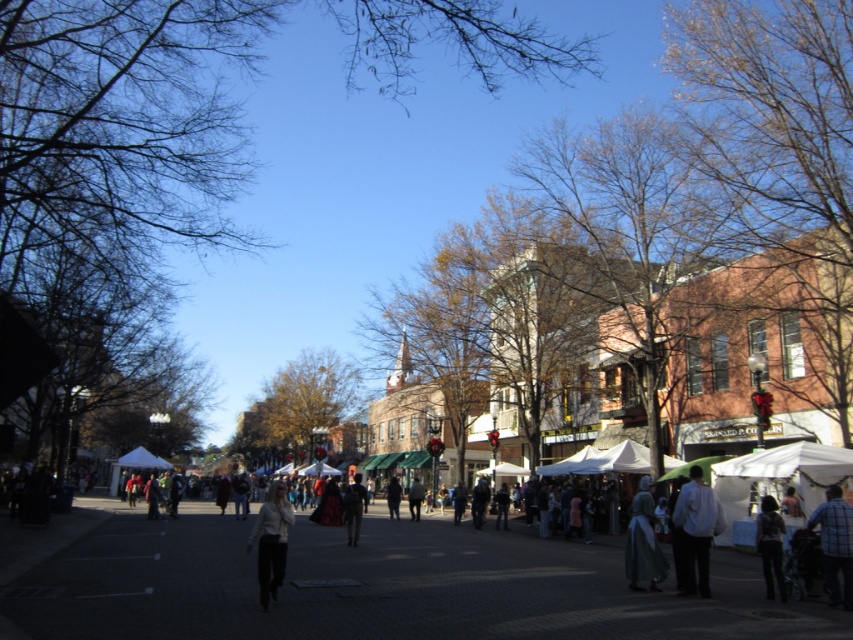
Question: Does white matte pants at center have a smaller size compared to white fabric canopy at center?

Choices:
 (A) yes
 (B) no

Answer: (A)

Question: Which object appears farthest from the camera in this image?

Choices:
 (A) plaid shirt at lower right
 (B) white cotton shirt at lower right
 (C) denim jacket at lower right
 (D) white matte pants at center

Answer: (C)

Question: Among these objects, which one is farthest from the camera?

Choices:
 (A) white fabric canopy at center
 (B) white matte pants at center

Answer: (A)

Question: Which of the following is the closest to the observer?

Choices:
 (A) plaid shirt at lower right
 (B) white matte pants at center
 (C) denim jacket at lower right

Answer: (B)

Question: Can you confirm if plaid shirt at lower right is positioned above white fabric canopy at center?

Choices:
 (A) no
 (B) yes

Answer: (B)

Question: Is white cotton shirt at lower right closer to the viewer compared to plaid shirt at lower right?

Choices:
 (A) yes
 (B) no

Answer: (B)